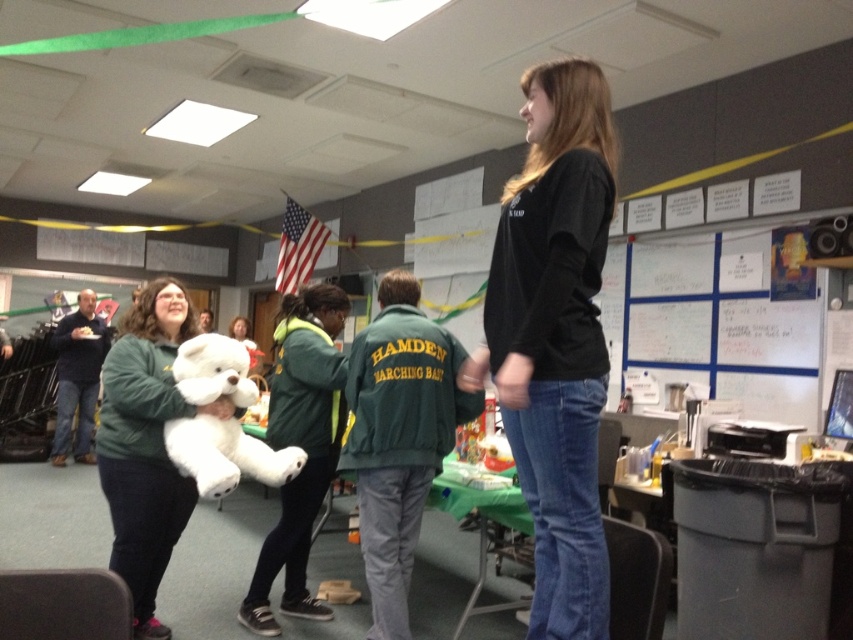
Question: Where is green fleece jacket at left located in relation to white plush teddy bear at center in the image?

Choices:
 (A) below
 (B) above

Answer: (A)

Question: Based on their relative distances, which object is nearer to the green fleece jacket at left?

Choices:
 (A) black matte shirt at center
 (B) white plush teddy bear at center
 (C) whiteboard at upper right

Answer: (B)

Question: Can you confirm if whiteboard at upper right is thinner than green fleece jacket at center?

Choices:
 (A) no
 (B) yes

Answer: (A)

Question: Does whiteboard at upper right have a lesser width compared to white plush teddy bear at center?

Choices:
 (A) yes
 (B) no

Answer: (B)

Question: Which object appears farthest from the camera in this image?

Choices:
 (A) green fleece jacket at left
 (B) green fleece jacket at center
 (C) whiteboard at upper right
 (D) black matte shirt at center

Answer: (C)

Question: Which is nearer to the green fleece jacket at left?

Choices:
 (A) white plush teddy bear at center
 (B) green fleece jacket at center

Answer: (A)